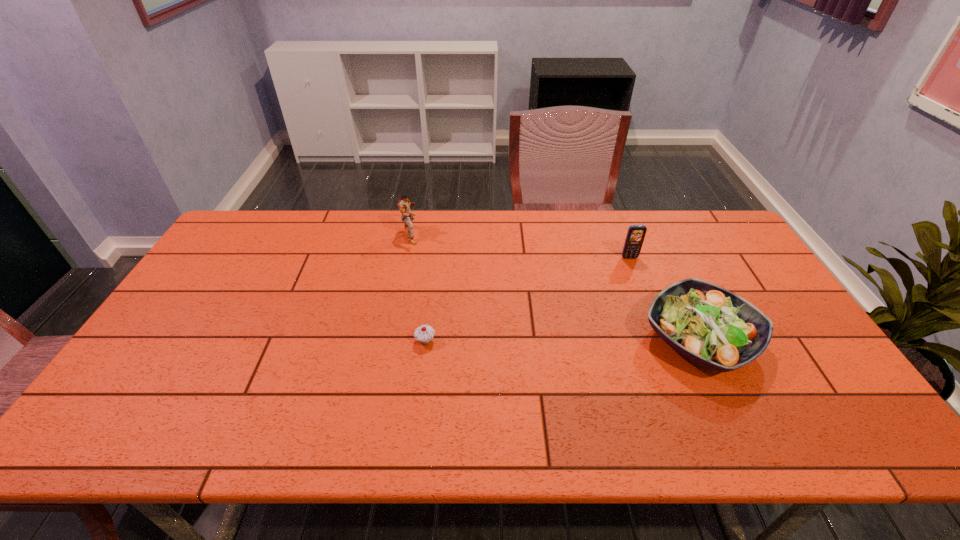
The width and height of the screenshot is (960, 540). I want to click on the farthest object, so click(404, 204).

Locate an element on the screen. This screenshot has width=960, height=540. puncher is located at coordinates (404, 204).

I want to click on the third nearest object, so pos(635,236).

The height and width of the screenshot is (540, 960). What are the coordinates of `the second tallest object` in the screenshot? It's located at pos(635,236).

Locate an element on the screen. The width and height of the screenshot is (960, 540). the second shortest object is located at coordinates (708, 324).

You are a GUI agent. You are given a task and a screenshot of the screen. Output one action in this format:
    pyautogui.click(x=<x>, y=<y>)
    Task: Click on the third object from right to left
    
    Given the screenshot: What is the action you would take?
    pyautogui.click(x=424, y=334)

The height and width of the screenshot is (540, 960). What are the coordinates of `cupcake` in the screenshot? It's located at (424, 334).

Where is `free spot located 0.120m on the front-facing side of the tallest object`? The height and width of the screenshot is (540, 960). free spot located 0.120m on the front-facing side of the tallest object is located at coordinates (455, 234).

In order to click on blank area located on the screen of the cellular telephone in this screenshot , I will do `click(638, 280)`.

Identify the location of free space located on the back of the second shortest object. (656, 249).